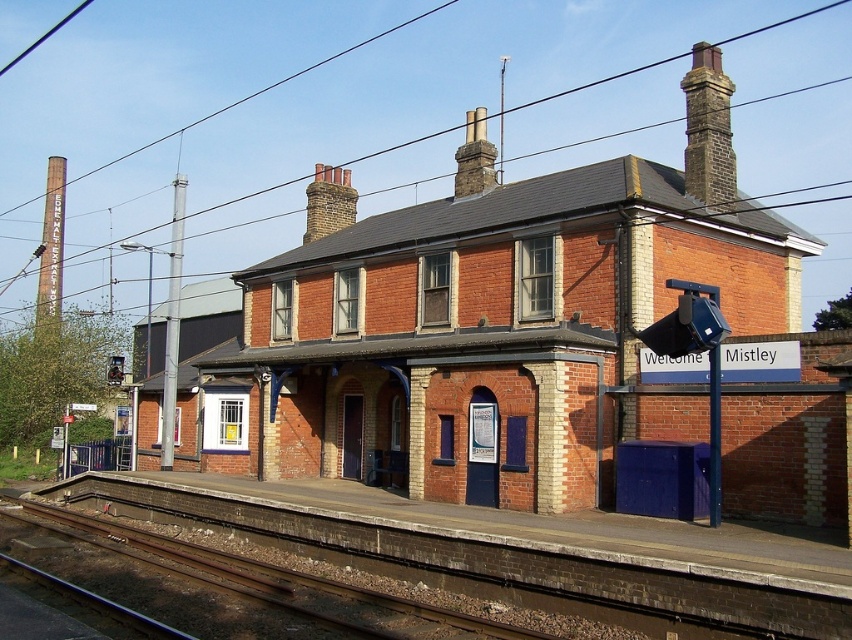
You are a photographer standing on the platform at the Mistley station. You want to take a photo of the dark brown stone chimney at upper right without the rusty metal train track at lower left blocking the view. Is this possible based on their positions?

The rusty metal train track at lower left is in front of the dark brown stone chimney at upper right, so the track will block the view of the chimney. Move to a position where the track is no longer between you and the chimney to capture it without obstruction.

You are standing at the Welcome Mistley sign on the platform and want to take a photo of both point [521,634] and point [699,116] in the image. Which point should you focus on first to ensure both are in sharp focus?

You should focus on point [521,634] first because it is closer to the camera than point [699,116]. By focusing on the closer point, the farther point will also be within the depth of field, ensuring both are in sharp focus.

You are a railway engineer inspecting the tracks. You notice the rusty metal train track at lower left and the dark brown stone chimney at upper right. Which object has a smaller width?

The rusty metal train track at lower left is thinner than the dark brown stone chimney at upper right, so the rusty metal train track at lower left has a smaller width.